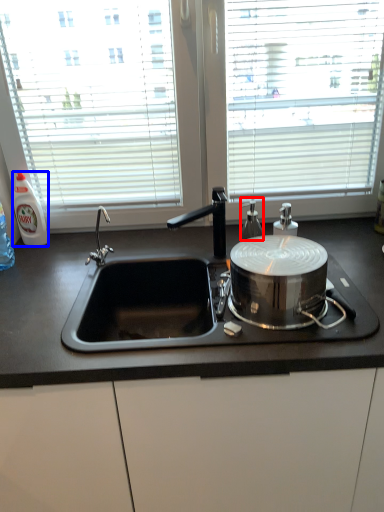
Question: Which of the following is the farthest to the observer, bottle (highlighted by a red box) or bottle (highlighted by a blue box)?

Choices:
 (A) bottle
 (B) bottle

Answer: (B)